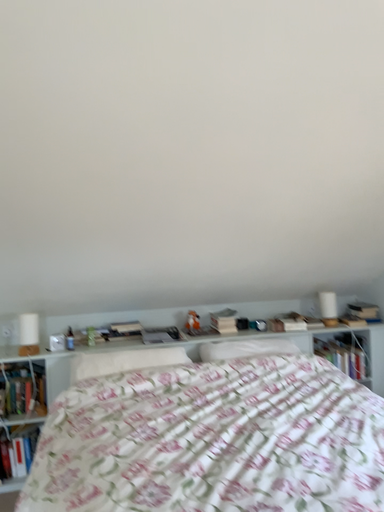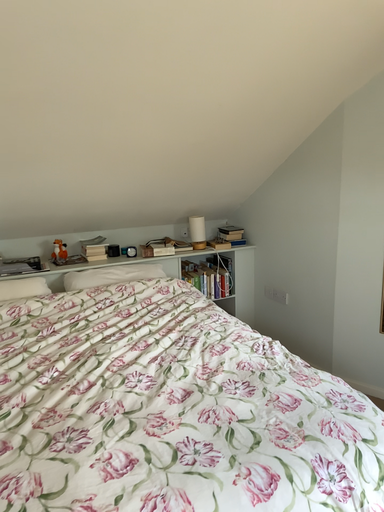
Question: Which way did the camera rotate in the video?

Choices:
 (A) rotated upward
 (B) rotated downward

Answer: (B)